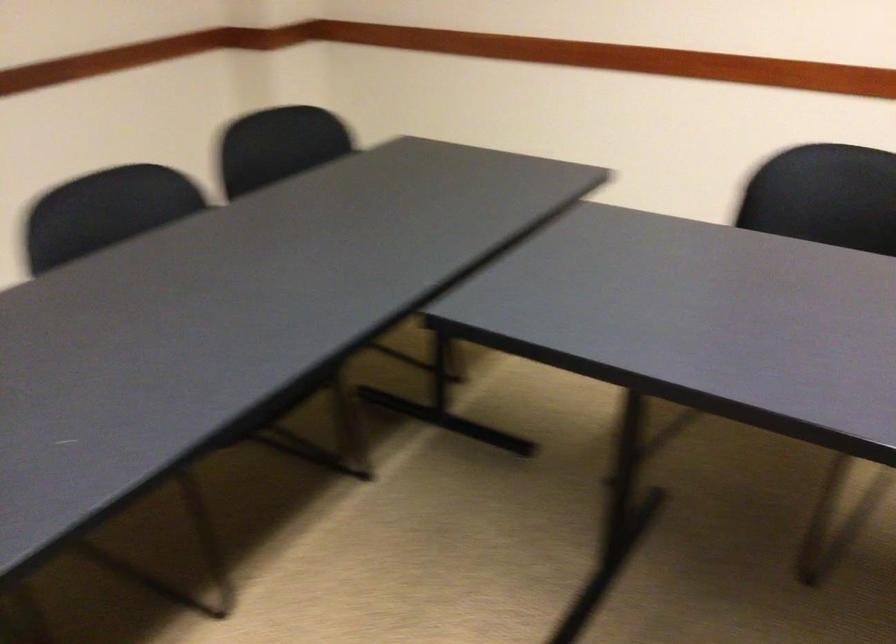
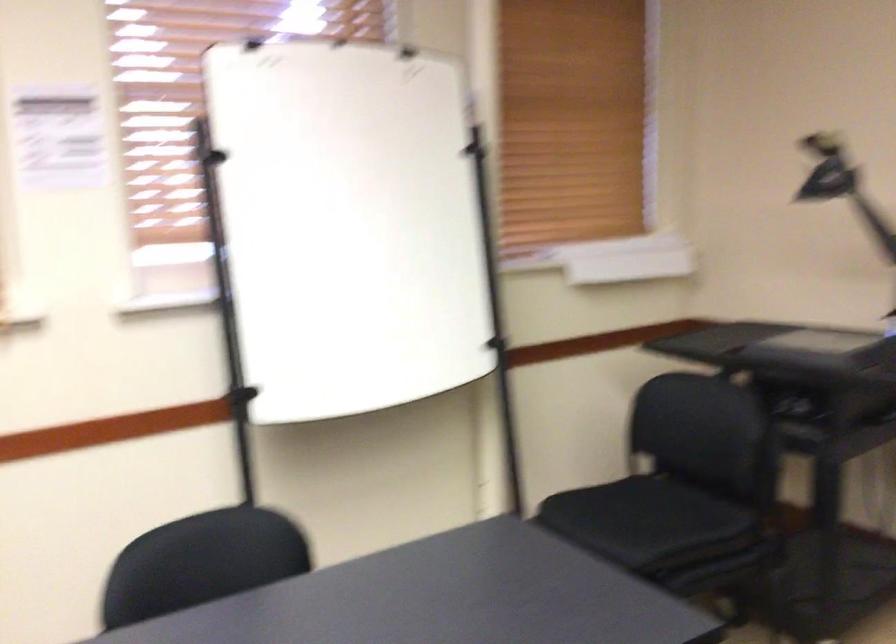
Question: How did the camera likely rotate?

Choices:
 (A) Left
 (B) Right
 (C) Up
 (D) Down

Answer: (B)